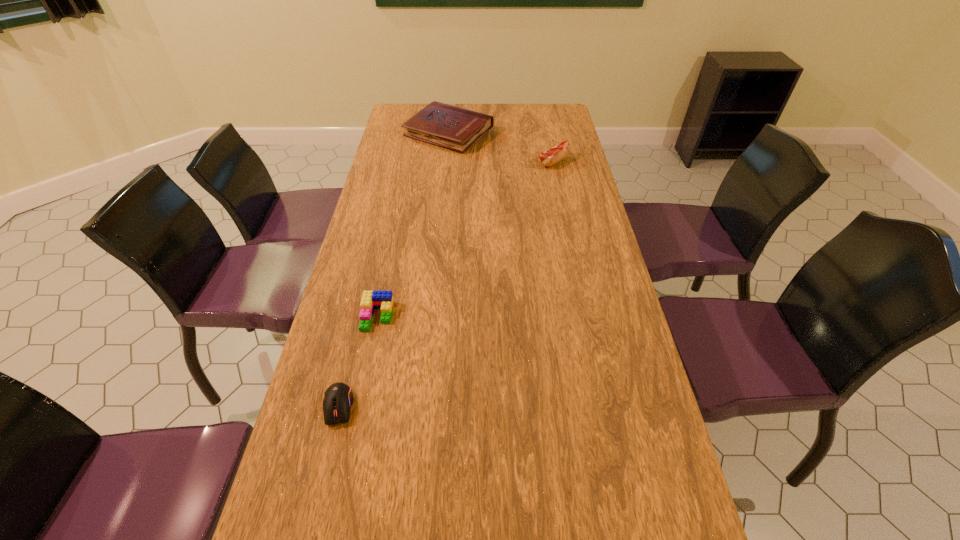
This screenshot has height=540, width=960. What are the coordinates of `free space in the image that satisfies the following two spatial constraints: 1. on the back side of the hardback book; 2. on the right side of the third tallest object` in the screenshot? It's located at (416, 133).

At what (x,y) coordinates should I click in order to perform the action: click on free spot that satisfies the following two spatial constraints: 1. on the back side of the Lego; 2. on the right side of the hardback book. Please return your answer as a coordinate pair (x, y). The image size is (960, 540). Looking at the image, I should click on (416, 133).